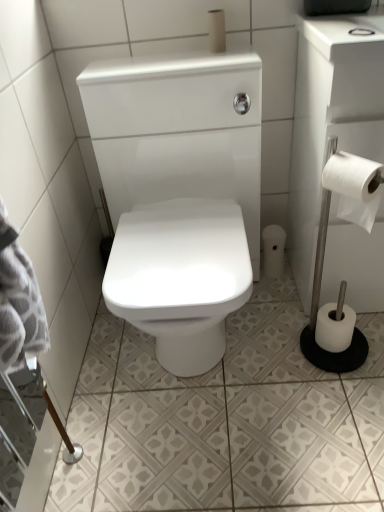
Where is `vacant area on the back side of white matte toilet paper at lower right, acting as the fourth toilet paper starting from the top`? Image resolution: width=384 pixels, height=512 pixels. vacant area on the back side of white matte toilet paper at lower right, acting as the fourth toilet paper starting from the top is located at coordinates (289, 307).